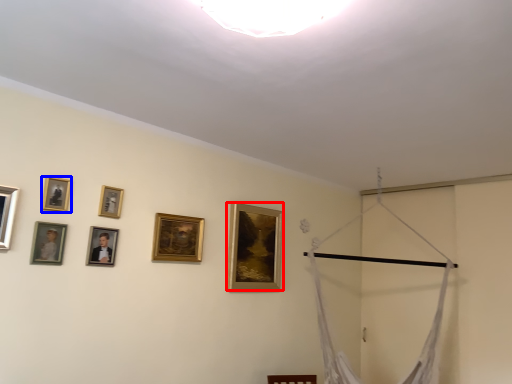
Question: Among these objects, which one is nearest to the camera, picture frame (highlighted by a red box) or picture frame (highlighted by a blue box)?

Choices:
 (A) picture frame
 (B) picture frame

Answer: (B)